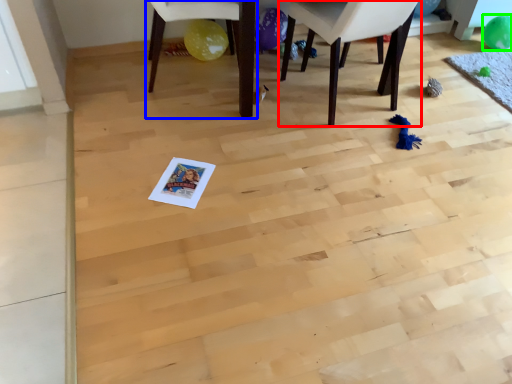
Question: Which is farther away from chair (highlighted by a red box)? chair (highlighted by a blue box) or balloon (highlighted by a green box)?

Choices:
 (A) chair
 (B) balloon

Answer: (B)